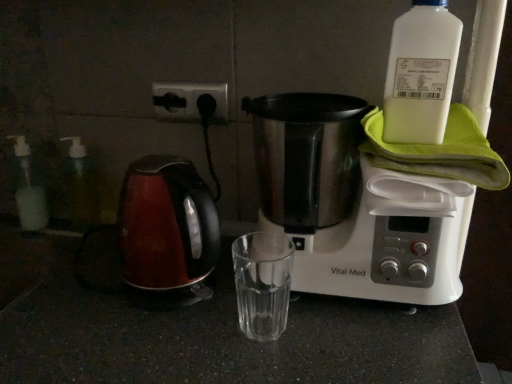
Question: Is stainless steel coffee maker at upper right not within shiny red kettle at left?

Choices:
 (A) no
 (B) yes

Answer: (B)

Question: Is stainless steel coffee maker at upper right smaller than shiny red kettle at left?

Choices:
 (A) no
 (B) yes

Answer: (A)

Question: Can you see stainless steel coffee maker at upper right touching shiny red kettle at left?

Choices:
 (A) yes
 (B) no

Answer: (B)

Question: Can you confirm if stainless steel coffee maker at upper right is positioned to the right of shiny red kettle at left?

Choices:
 (A) yes
 (B) no

Answer: (A)

Question: Is stainless steel coffee maker at upper right taller than shiny red kettle at left?

Choices:
 (A) no
 (B) yes

Answer: (B)

Question: In the image, is stainless steel coffee maker at upper right on the left side or the right side of translucent plastic soap dispenser at left, the first bottle viewed from the left?

Choices:
 (A) right
 (B) left

Answer: (A)

Question: Is stainless steel coffee maker at upper right taller or shorter than translucent plastic soap dispenser at left, which is the 1th bottle in back-to-front order?

Choices:
 (A) short
 (B) tall

Answer: (B)

Question: Considering the positions of point (296, 147) and point (33, 180), is point (296, 147) closer or farther from the camera than point (33, 180)?

Choices:
 (A) closer
 (B) farther

Answer: (A)

Question: Looking at their shapes, would you say stainless steel coffee maker at upper right is wider or thinner than translucent plastic soap dispenser at left, the third bottle viewed from the front?

Choices:
 (A) thin
 (B) wide

Answer: (B)

Question: From a real-world perspective, is transparent plastic bottle at left, which is the second bottle from back to front, above or below black plastic socket at upper center?

Choices:
 (A) below
 (B) above

Answer: (A)

Question: From the image's perspective, is transparent plastic bottle at left, positioned as the 2th bottle in left-to-right order, located above or below black plastic socket at upper center?

Choices:
 (A) below
 (B) above

Answer: (A)

Question: Considering the positions of transparent plastic bottle at left, the 2th bottle in the right-to-left sequence, and black plastic socket at upper center in the image, is transparent plastic bottle at left, the 2th bottle in the right-to-left sequence, wider or thinner than black plastic socket at upper center?

Choices:
 (A) thin
 (B) wide

Answer: (B)

Question: Looking at the image, does transparent plastic bottle at left, positioned as the 2th bottle in left-to-right order, seem bigger or smaller compared to black plastic socket at upper center?

Choices:
 (A) big
 (B) small

Answer: (A)

Question: Is transparent plastic bottle at left, positioned as the 2th bottle in left-to-right order, to the left or to the right of translucent plastic soap dispenser at left, the 3th bottle positioned from the right, in the image?

Choices:
 (A) right
 (B) left

Answer: (A)

Question: Relative to translucent plastic soap dispenser at left, the third bottle viewed from the front, is transparent plastic bottle at left, which is the second bottle from back to front, in front or behind?

Choices:
 (A) front
 (B) behind

Answer: (A)